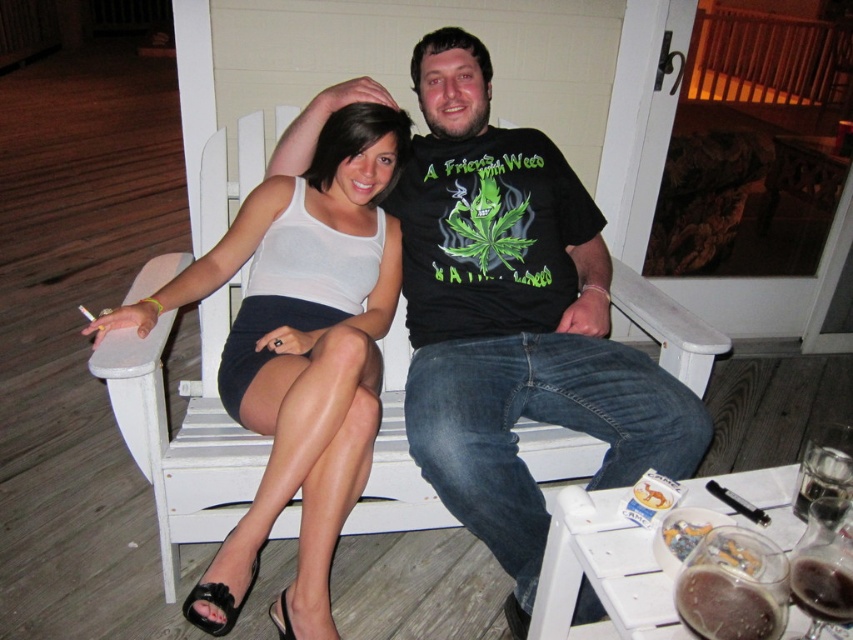
You are a photographer standing in front of the scene. You want to take a photo that includes both the white matte tank top at center and the translucent glass beer at lower right. Which object will appear larger in the photo?

The white matte tank top at center will appear larger in the photo because it is closer to the photographer than the translucent glass beer at lower right.